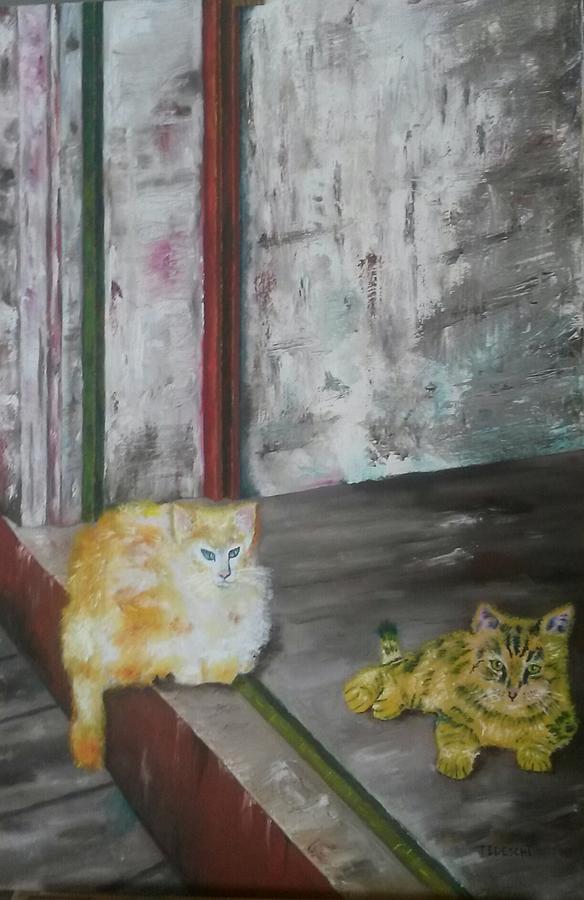
What are the coordinates of `gray stair step` in the screenshot? It's located at (215, 704).